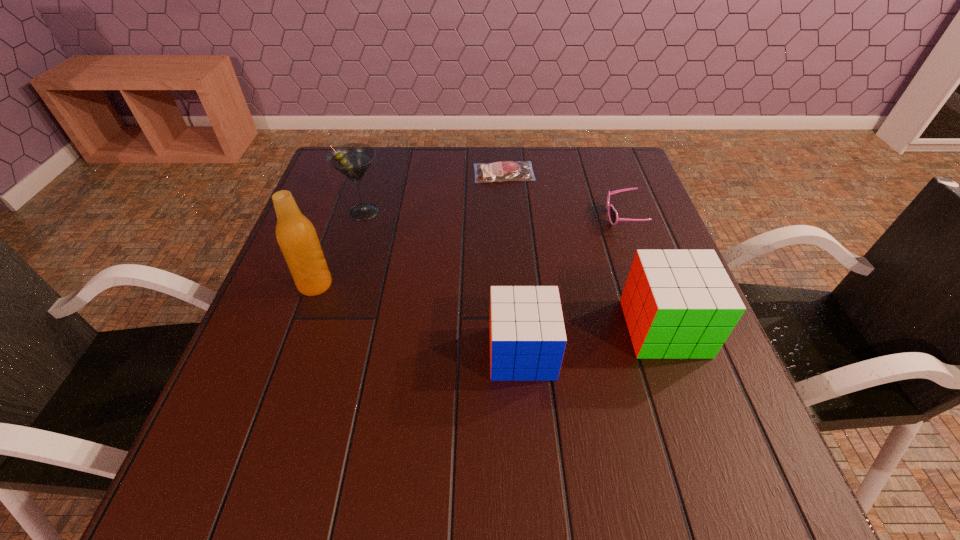
At what (x,y) coordinates should I click in order to perform the action: click on free space between the fourth shortest object and the martini. Please return your answer as a coordinate pair (x, y). This screenshot has height=540, width=960. Looking at the image, I should click on (514, 270).

Find the location of a particular element. The image size is (960, 540). free point between the sunglasses and the martini is located at coordinates (493, 214).

Where is `vacant space that is in between the shorter cube and the shortest object`? The width and height of the screenshot is (960, 540). vacant space that is in between the shorter cube and the shortest object is located at coordinates (513, 263).

Where is `free spot between the farthest object and the right cube`? The image size is (960, 540). free spot between the farthest object and the right cube is located at coordinates (584, 251).

Identify the location of free spot between the fourth tallest object and the martini. The image size is (960, 540). (443, 282).

Find the location of a particular element. The width and height of the screenshot is (960, 540). empty space between the shorter cube and the second tallest object is located at coordinates (443, 282).

Where is `free space between the third shortest object and the martini`? free space between the third shortest object and the martini is located at coordinates (443, 282).

Where is `free space between the farthest object and the shorter cube`? free space between the farthest object and the shorter cube is located at coordinates (513, 263).

Where is `object that is the fourth closest one to the third nearest object`? object that is the fourth closest one to the third nearest object is located at coordinates (678, 304).

I want to click on object that is the second closest to the left cube, so click(x=612, y=213).